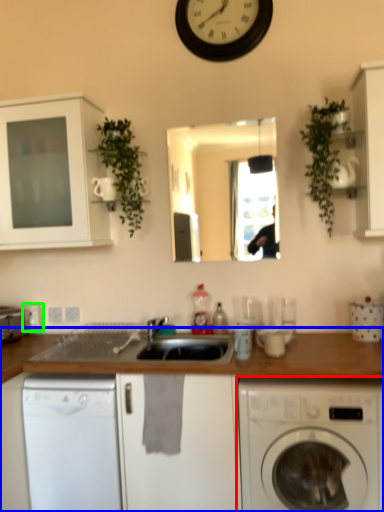
Question: Which object is positioned farthest from washing machine (highlighted by a red box)? Select from countertop (highlighted by a blue box) and electric outlet (highlighted by a green box).

Choices:
 (A) countertop
 (B) electric outlet

Answer: (B)